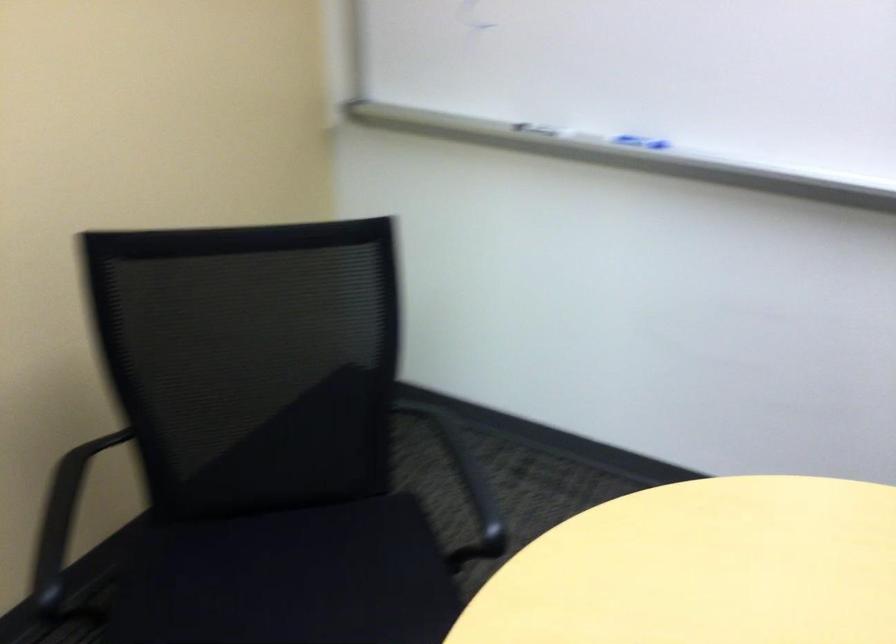
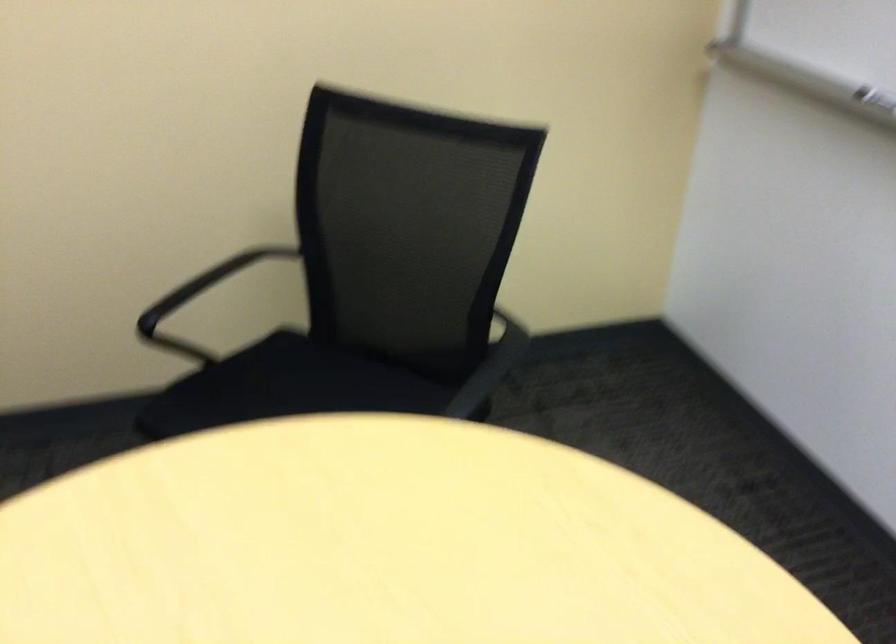
Question: The images are taken continuously from a first-person perspective. In which direction is your viewpoint rotating?

Choices:
 (A) Left
 (B) Right
 (C) Up
 (D) Down

Answer: (A)